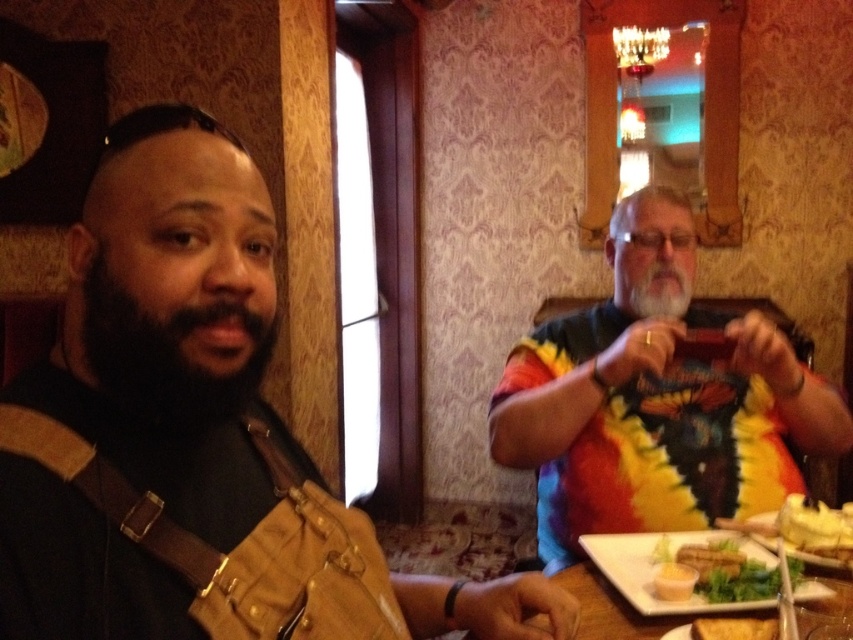
Which is above, white ceramic plate at lower right or green leafy salad at lower right?

green leafy salad at lower right is higher up.

Which is more to the left, white ceramic plate at lower right or green leafy salad at lower right?

From the viewer's perspective, white ceramic plate at lower right appears more on the left side.

Between point (705, 532) and point (693, 557), which one is positioned behind?

The point (705, 532) is more distant.

Identify the location of white ceramic plate at lower right. This screenshot has height=640, width=853. (659, 566).

Does white soft beard at center have a smaller size compared to green leafy salad at lower right?

Actually, white soft beard at center might be larger than green leafy salad at lower right.

From the picture: Does white soft beard at center come in front of green leafy salad at lower right?

No, it is not.

Who is more distant from viewer, [659,316] or [740,557]?

The point [659,316] is more distant.

Where is `white soft beard at center`? The height and width of the screenshot is (640, 853). white soft beard at center is located at coordinates (654, 291).

Image resolution: width=853 pixels, height=640 pixels. What do you see at coordinates (193, 436) in the screenshot? I see `brown leather jacket at left` at bounding box center [193, 436].

Does brown leather jacket at left appear on the right side of black fuzzy beard at left?

Correct, you'll find brown leather jacket at left to the right of black fuzzy beard at left.

The width and height of the screenshot is (853, 640). I want to click on brown leather jacket at left, so click(x=193, y=436).

Identify the location of brown leather jacket at left. (193, 436).